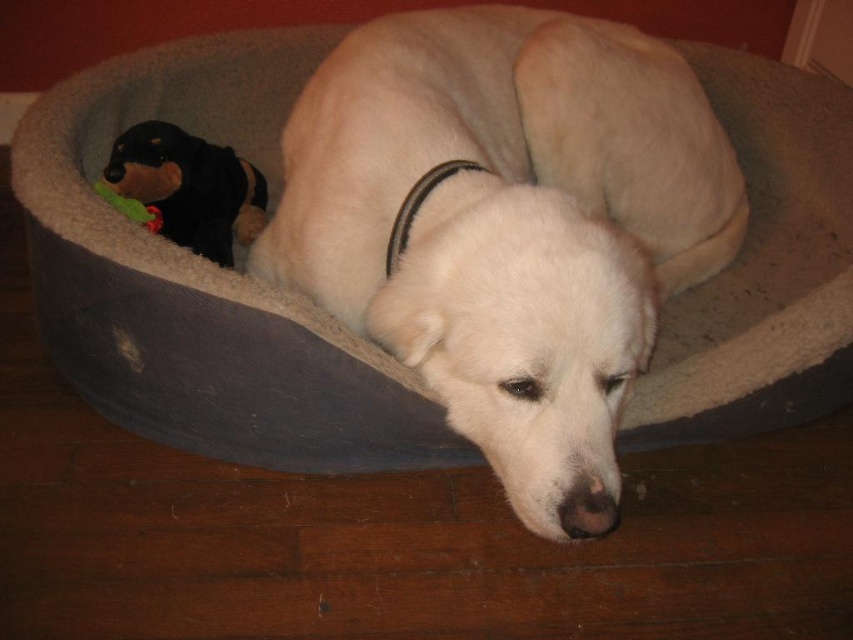
Does black plush toy at upper left appear over green plush toy at left?

Indeed, black plush toy at upper left is positioned over green plush toy at left.

Can you confirm if black plush toy at upper left is positioned to the left of green plush toy at left?

Incorrect, black plush toy at upper left is not on the left side of green plush toy at left.

Identify the location of black plush toy at upper left. This screenshot has width=853, height=640. (189, 188).

Is white fur dog at center taller than black/leather neckband at center?

Yes, white fur dog at center is taller than black/leather neckband at center.

Who is shorter, white fur dog at center or black/leather neckband at center?

black/leather neckband at center is shorter.

Identify the location of white fur dog at center. (508, 225).

Measure the distance from black/leather neckband at center to green plush toy at left.

black/leather neckband at center is 16.99 inches away from green plush toy at left.

Who is shorter, black/leather neckband at center or green plush toy at left?

green plush toy at left

At what (x,y) coordinates should I click in order to perform the action: click on black/leather neckband at center. Please return your answer as a coordinate pair (x, y). The image size is (853, 640). Looking at the image, I should click on (421, 205).